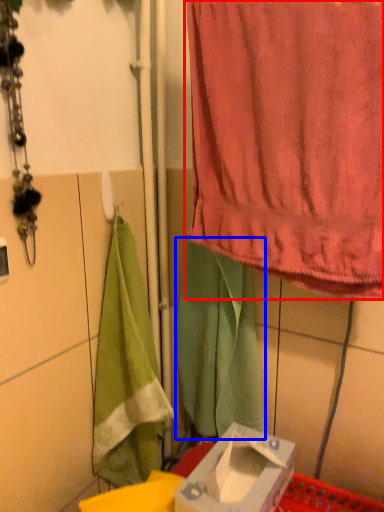
Question: Which object appears closest to the camera in this image, curtain (highlighted by a red box) or cloth (highlighted by a blue box)?

Choices:
 (A) curtain
 (B) cloth

Answer: (A)